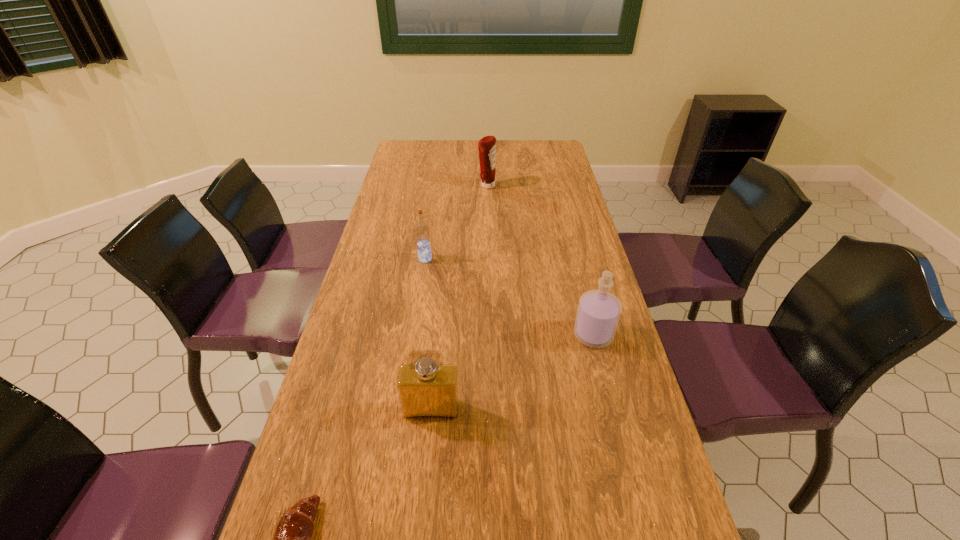
The image size is (960, 540). I want to click on vacant area that lies between the nearer perfume and the second farthest object, so click(x=428, y=334).

Find the location of `object that stands as the second closest to the nearer perfume`. object that stands as the second closest to the nearer perfume is located at coordinates (598, 313).

Identify which object is the nearest to the fourth object from left to right. Please provide its 2D coordinates. Your answer should be formatted as a tuple, i.e. [(x, y)], where the tuple contains the x and y coordinates of a point satisfying the conditions above.

[(422, 232)]